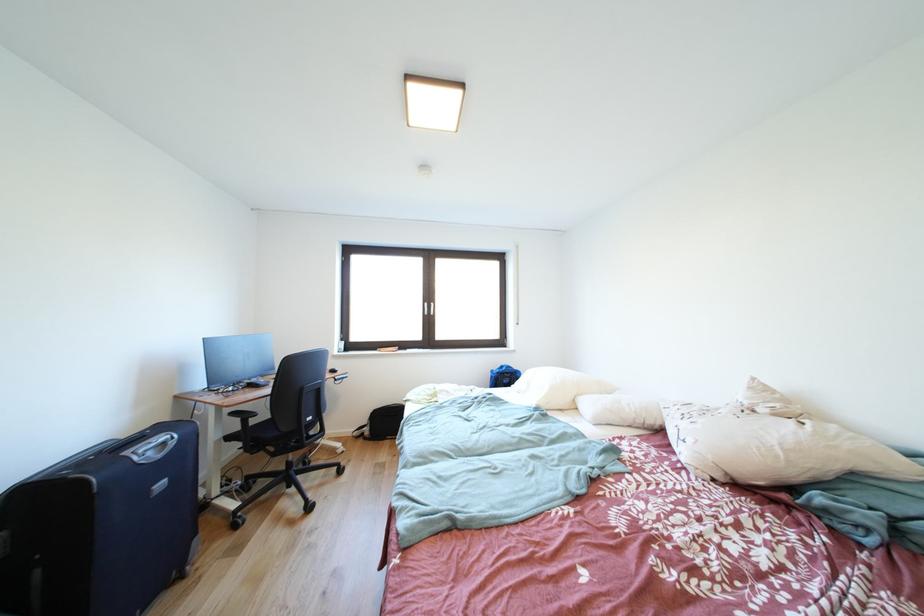
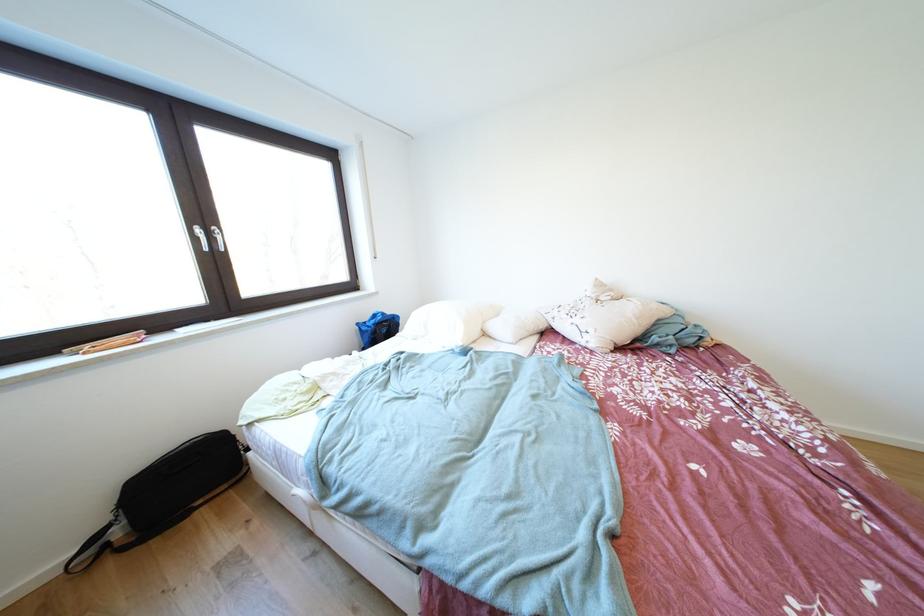
The point at [373,427] is marked in the first image. Where is the corresponding point in the second image?

(114, 524)